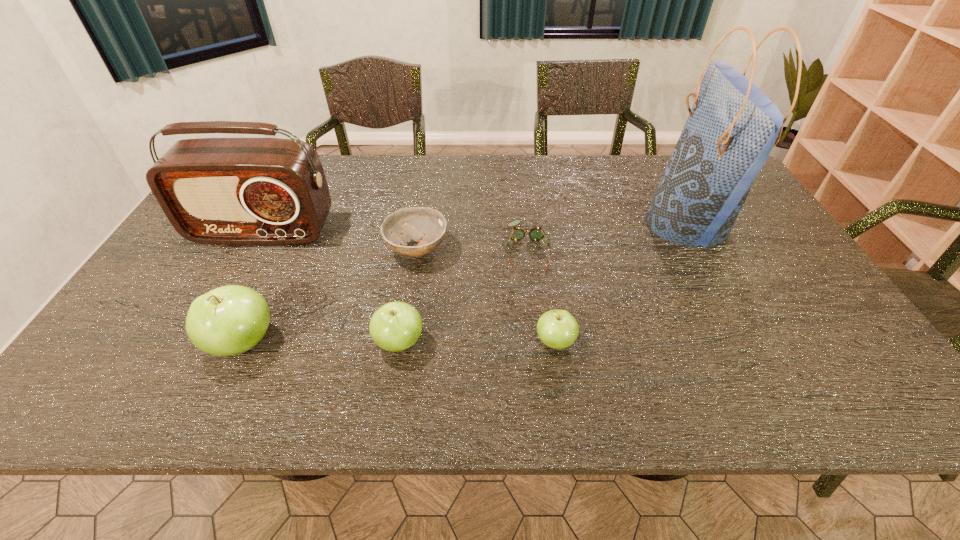
I want to click on object at the far right corner, so click(x=732, y=127).

In the image, there is a desktop. Identify the location of vacant space at the far edge. (411, 178).

Image resolution: width=960 pixels, height=540 pixels. Identify the location of free location at the near edge. (736, 336).

Where is `vacant space at the right edge`? This screenshot has width=960, height=540. vacant space at the right edge is located at coordinates (749, 231).

Locate an element on the screen. The image size is (960, 540). vacant area that lies between the sixth tallest object and the shortest apple is located at coordinates (486, 296).

Locate an element on the screen. The image size is (960, 540). vacant space in between the second shortest apple and the rightmost apple is located at coordinates (477, 342).

Identify the location of vacant area between the shopping bag and the second tallest object. (475, 228).

Image resolution: width=960 pixels, height=540 pixels. What are the coordinates of `unoccupied area between the sixth tallest object and the second shortest apple` in the screenshot? It's located at (408, 296).

Image resolution: width=960 pixels, height=540 pixels. In order to click on empty space that is in between the radio receiver and the shortest apple in this screenshot , I will do `click(409, 287)`.

You are a GUI agent. You are given a task and a screenshot of the screen. Output one action in this format:
    pyautogui.click(x=<x>, y=<y>)
    Task: Click on the free space between the shopping bag and the second apple from left to right
    
    Given the screenshot: What is the action you would take?
    pyautogui.click(x=543, y=284)